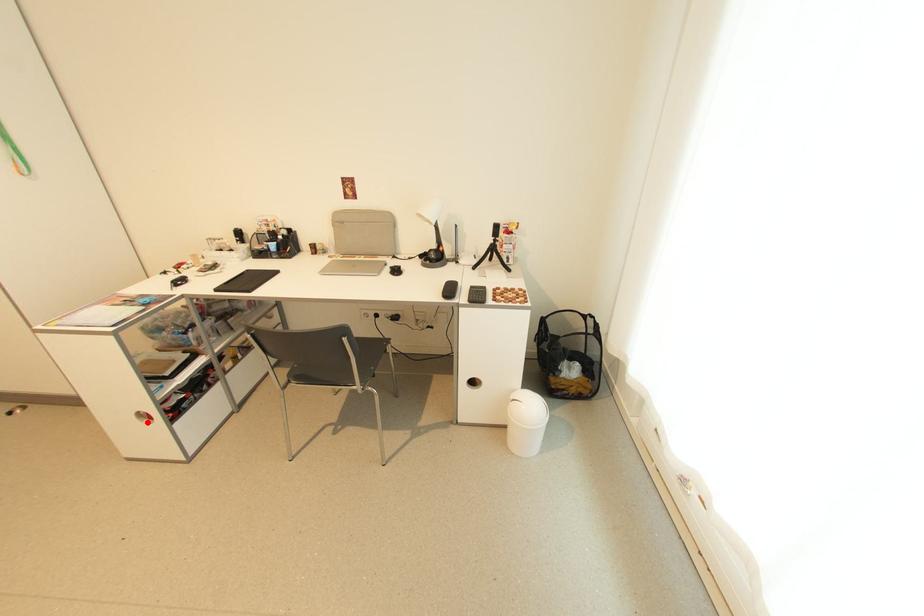
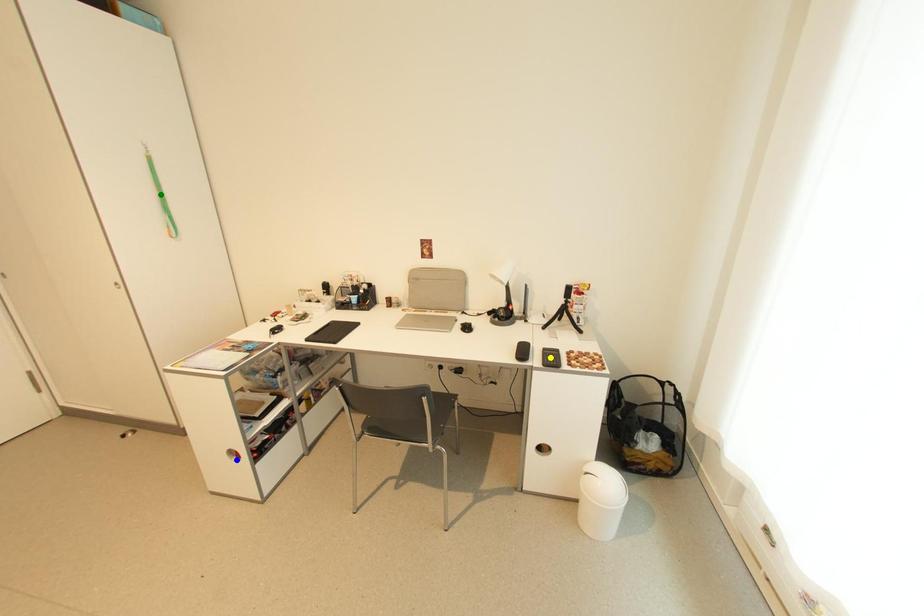
Question: I am providing you with two images of the same scene from different viewpoints. A red point is marked on the first image. You are given multiple points on the second image. Which point in image 2 is actually the same real-world point as the red point in image 1?

Choices:
 (A) blue point
 (B) yellow point
 (C) green point

Answer: (A)